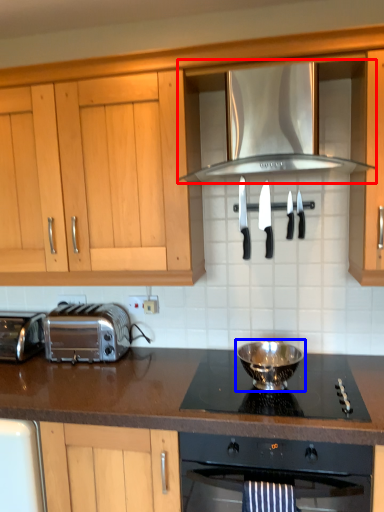
Question: Which of the following is the farthest to the observer, exhaust hood (highlighted by a red box) or kitchen appliance (highlighted by a blue box)?

Choices:
 (A) exhaust hood
 (B) kitchen appliance

Answer: (B)